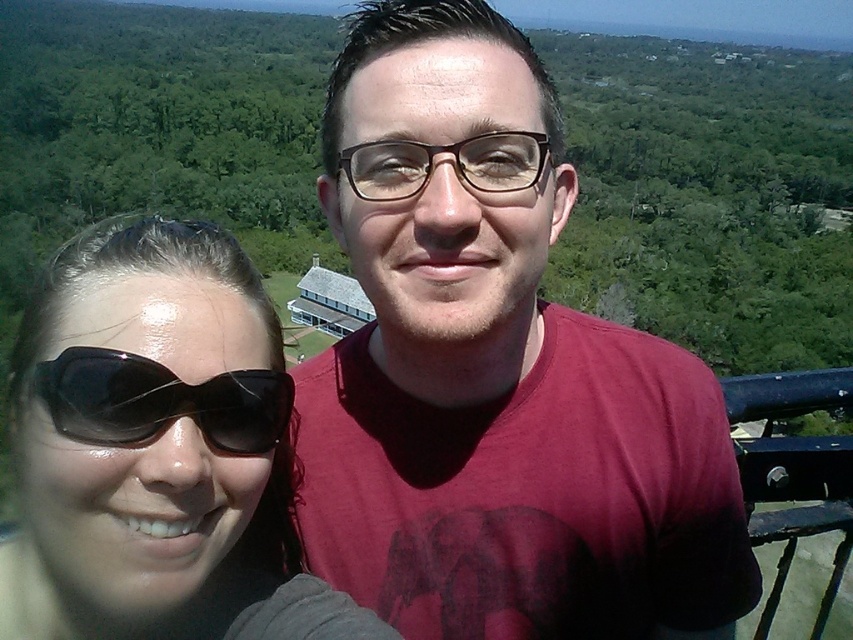
Where is `matte red t-shirt at center`? This screenshot has width=853, height=640. matte red t-shirt at center is located at coordinates click(495, 372).

Between point (299, 436) and point (99, 516), which one is positioned behind?

The point (299, 436) is behind.

The width and height of the screenshot is (853, 640). I want to click on matte red t-shirt at center, so click(495, 372).

I want to click on matte red t-shirt at center, so click(x=495, y=372).

Is matte red t-shirt at center to the left of black matte sunglasses at left from the viewer's perspective?

Incorrect, matte red t-shirt at center is not on the left side of black matte sunglasses at left.

Is matte red t-shirt at center further to camera compared to black matte sunglasses at left?

Yes.

Measure the distance between point (x=296, y=468) and camera.

Point (x=296, y=468) and camera are 3.61 meters apart from each other.

The height and width of the screenshot is (640, 853). What are the coordinates of `matte red t-shirt at center` in the screenshot? It's located at (495, 372).

At what (x,y) coordinates should I click in order to perform the action: click on sunglasses at left. Please return your answer as a coordinate pair (x, y). The height and width of the screenshot is (640, 853). Looking at the image, I should click on (155, 449).

Who is taller, sunglasses at left or black matte sunglasses at left?

sunglasses at left

Locate an element on the screen. sunglasses at left is located at coordinates (155, 449).

Identify the location of sunglasses at left. The width and height of the screenshot is (853, 640). (155, 449).